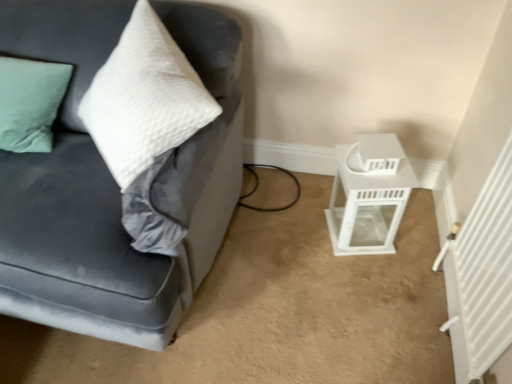
Question: Is velvet gray couch at left inside or outside of white glossy lantern at lower right?

Choices:
 (A) inside
 (B) outside

Answer: (B)

Question: From the image's perspective, relative to white glossy lantern at lower right, is velvet gray couch at left above or below?

Choices:
 (A) below
 (B) above

Answer: (B)

Question: From a real-world perspective, is velvet gray couch at left physically located above or below white glossy lantern at lower right?

Choices:
 (A) above
 (B) below

Answer: (A)

Question: Looking at the image, does white glossy lantern at lower right seem bigger or smaller compared to velvet gray couch at left?

Choices:
 (A) big
 (B) small

Answer: (B)

Question: Considering the positions of white glossy lantern at lower right and velvet gray couch at left in the image, is white glossy lantern at lower right wider or thinner than velvet gray couch at left?

Choices:
 (A) thin
 (B) wide

Answer: (A)

Question: Relative to velvet gray couch at left, is white glossy lantern at lower right in front or behind?

Choices:
 (A) front
 (B) behind

Answer: (B)

Question: Does point (370, 233) appear closer or farther from the camera than point (202, 241)?

Choices:
 (A) farther
 (B) closer

Answer: (A)